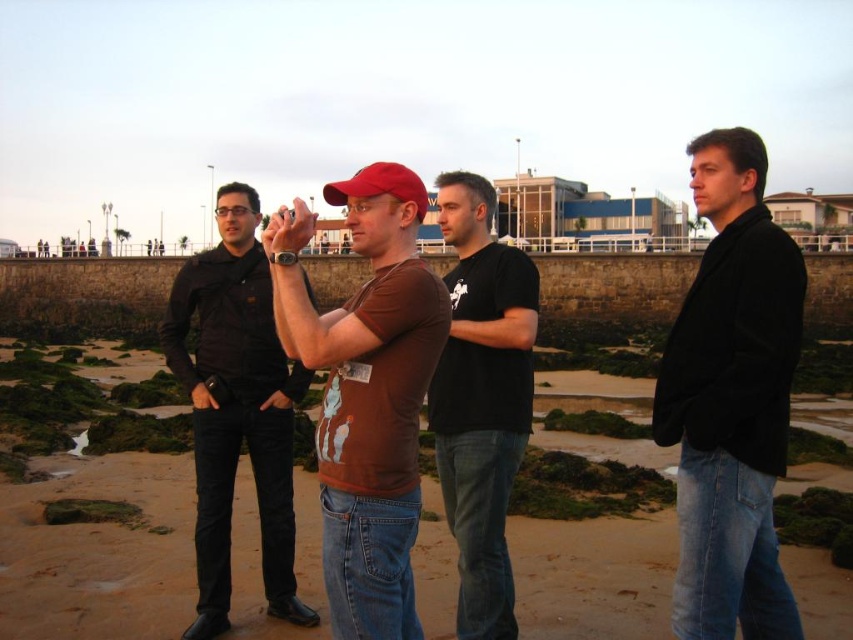
Question: Is black cotton t-shirt at center to the right of matte red baseball cap at center from the viewer's perspective?

Choices:
 (A) yes
 (B) no

Answer: (A)

Question: Which object is closer to the camera taking this photo?

Choices:
 (A) black smooth shirt at center
 (B) brown cotton t-shirt at center
 (C) brown sand at center

Answer: (B)

Question: Which point appears farthest from the camera in this image?

Choices:
 (A) (202, 385)
 (B) (347, 195)
 (C) (485, 531)
 (D) (410, 172)

Answer: (A)

Question: Where is brown sand at center located in relation to black cotton t-shirt at center in the image?

Choices:
 (A) above
 (B) below

Answer: (B)

Question: Does black smooth shirt at center appear over black cotton t-shirt at center?

Choices:
 (A) yes
 (B) no

Answer: (B)

Question: Which point is farther to the camera?

Choices:
 (A) (695, 360)
 (B) (480, 465)
 (C) (223, 224)
 (D) (338, 189)

Answer: (C)